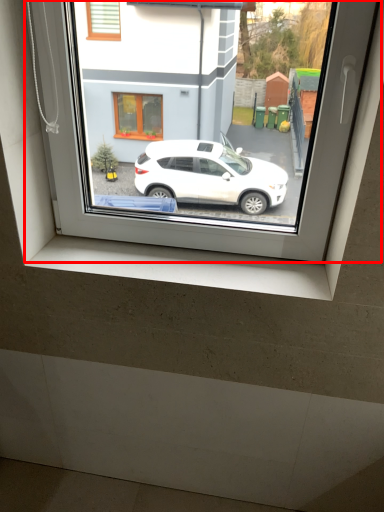
Question: From the image's perspective, where is window (annotated by the red box) located relative to window sill?

Choices:
 (A) below
 (B) above

Answer: (B)